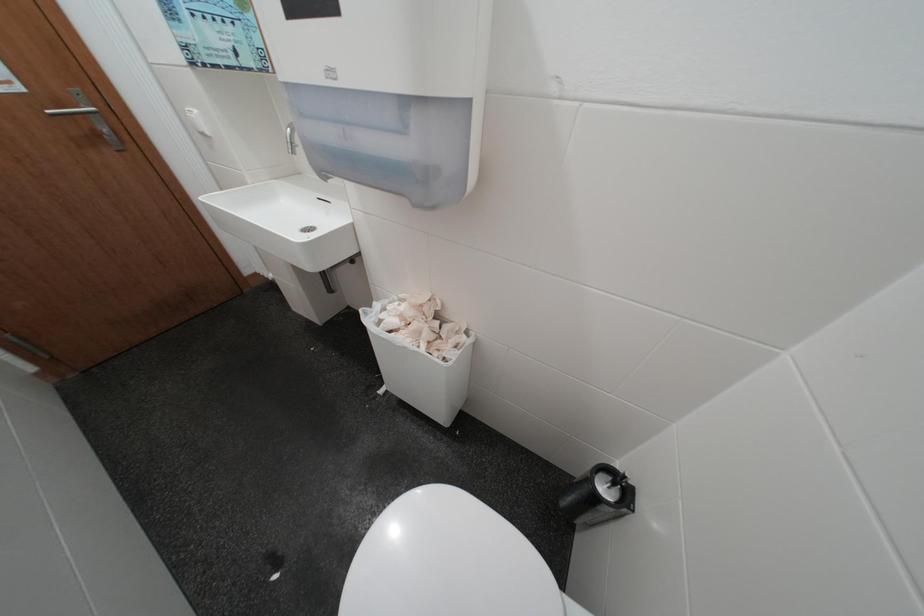
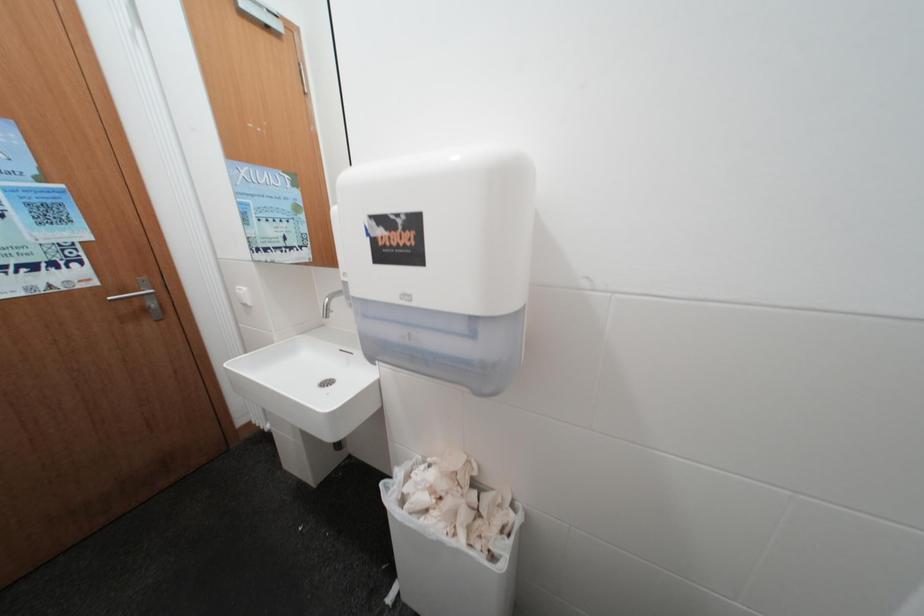
Question: What movement of the cameraman would produce the second image?

Choices:
 (A) Left
 (B) Right
 (C) Forward
 (D) Backward

Answer: (A)